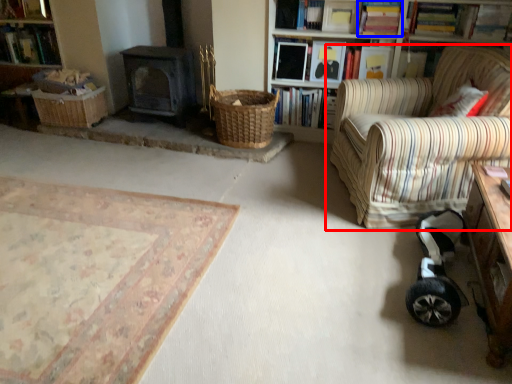
Question: Which object appears closest to the camera in this image, chair (highlighted by a red box) or book (highlighted by a blue box)?

Choices:
 (A) chair
 (B) book

Answer: (A)